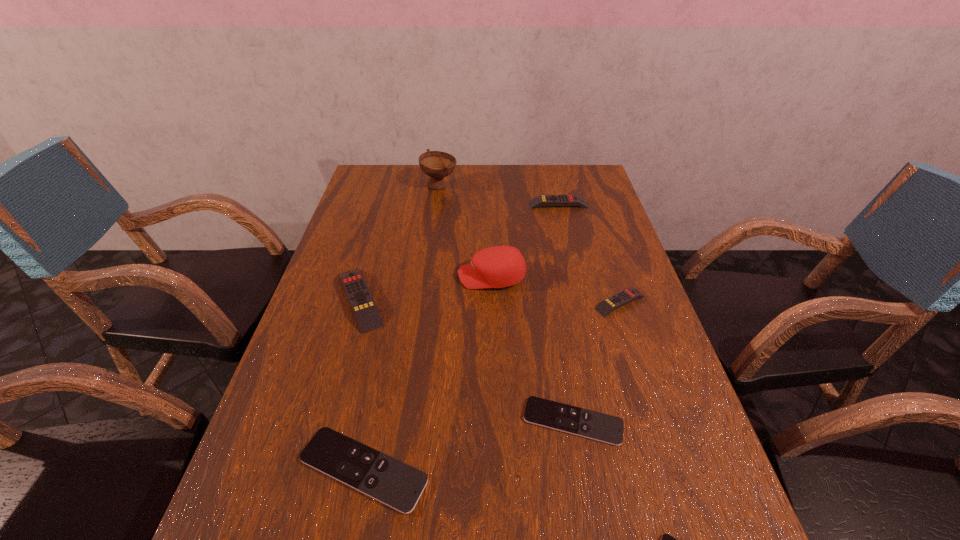
I want to click on vacant area situated 0.300m on the back of the fourth shortest object, so click(x=594, y=223).

The image size is (960, 540). Identify the location of blank space located 0.170m on the right of the biggest black remote control. (522, 470).

Image resolution: width=960 pixels, height=540 pixels. Find the location of `vacant space situated 0.120m on the right of the second biggest black remote control`. vacant space situated 0.120m on the right of the second biggest black remote control is located at coordinates (683, 422).

Locate an element on the screen. The width and height of the screenshot is (960, 540). object present at the far edge is located at coordinates [x=436, y=164].

You are a GUI agent. You are given a task and a screenshot of the screen. Output one action in this format:
    pyautogui.click(x=<x>, y=<y>)
    Task: Click on the free space at the far edge of the desktop
    
    Given the screenshot: What is the action you would take?
    pyautogui.click(x=456, y=177)

This screenshot has width=960, height=540. Identify the location of vacant space at the left edge. (341, 401).

This screenshot has height=540, width=960. I want to click on vacant space at the right edge, so click(x=580, y=226).

The image size is (960, 540). Find the location of `vacant space at the far right corner of the desktop`. vacant space at the far right corner of the desktop is located at coordinates (564, 187).

Locate an element on the screen. free space between the cap and the smallest yellow remote control is located at coordinates (556, 290).

Find the location of a particular element. unoccupied area between the tallest object and the leftmost black remote control is located at coordinates (x=401, y=328).